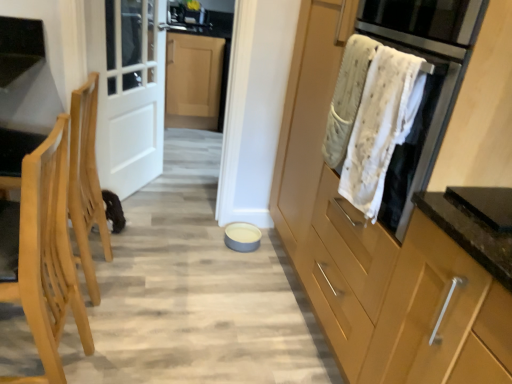
Question: Is clear glass door at upper left taller or shorter than white matte bowl at center?

Choices:
 (A) short
 (B) tall

Answer: (B)

Question: Based on their sizes in the image, would you say clear glass door at upper left is bigger or smaller than white matte bowl at center?

Choices:
 (A) big
 (B) small

Answer: (A)

Question: Estimate the real-world distances between objects in this image. Which object is closer to the matte wood cabinet at center?

Choices:
 (A) matte white sink at upper center
 (B) white matte bowl at center
 (C) white wood door at left
 (D) clear glass door at upper left
 (E) white textured towel at upper right

Answer: (E)

Question: Estimate the real-world distances between objects in this image. Which object is farther from the white wood door at left?

Choices:
 (A) white textured towel at upper right
 (B) matte wood cabinet at center
 (C) white textured towel at upper right
 (D) light wood chair at left
 (E) matte white sink at upper center

Answer: (E)